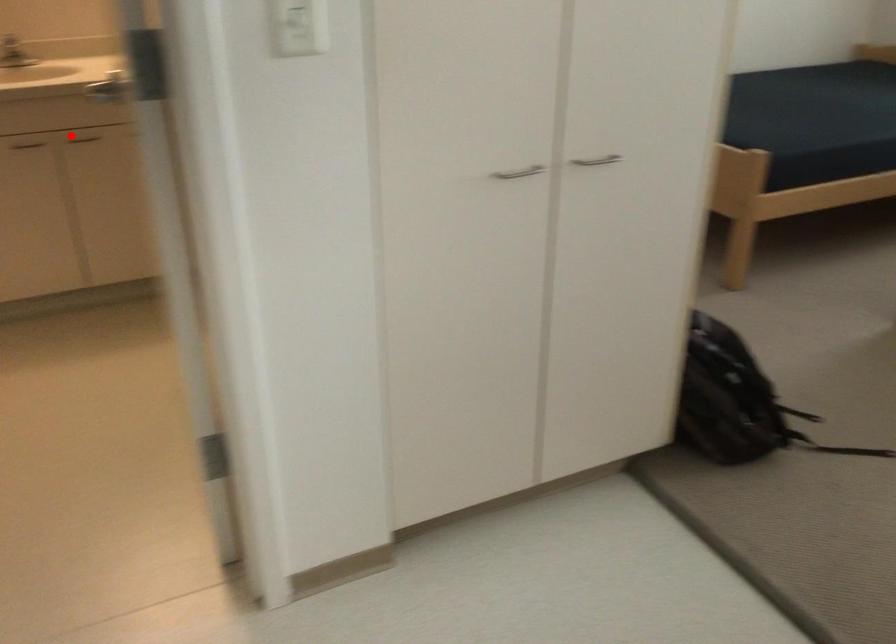
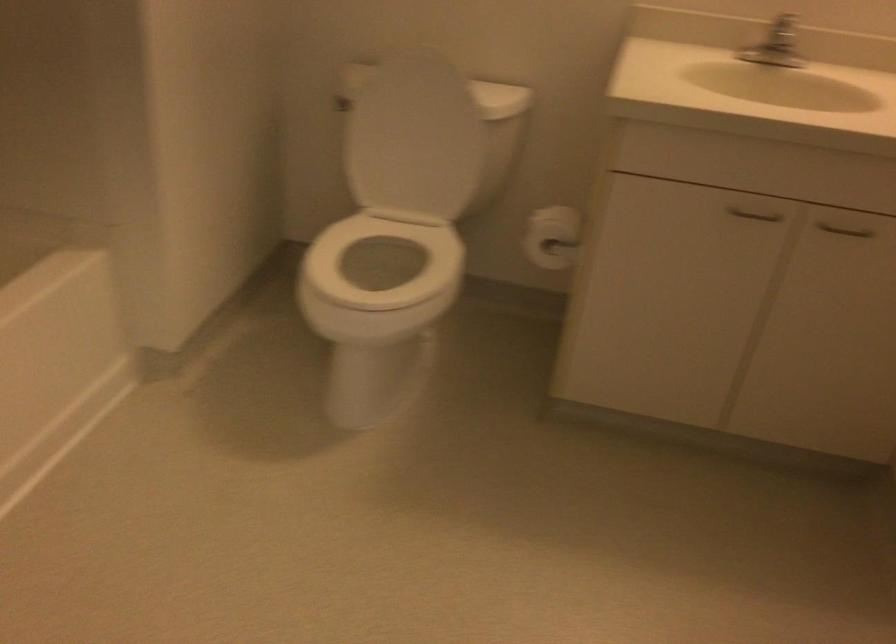
Question: A red point is marked in image1. In image2, is the corresponding 3D point closer to the camera or farther? Reply with the corresponding letter.

Choices:
 (A) The corresponding 3D point is closer.
 (B) The corresponding 3D point is farther.

Answer: (A)